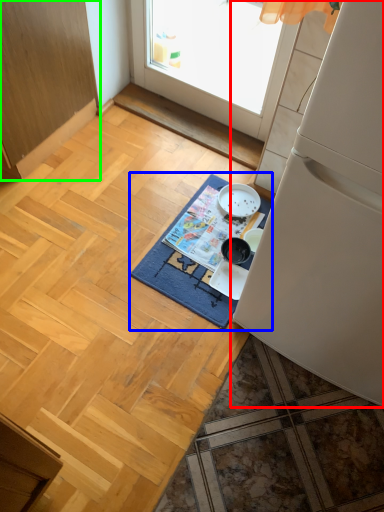
Question: Based on their relative distances, which object is farther from refrigerator (highlighted by a red box)? Choose from mat (highlighted by a blue box) and cabinetry (highlighted by a green box).

Choices:
 (A) mat
 (B) cabinetry

Answer: (B)